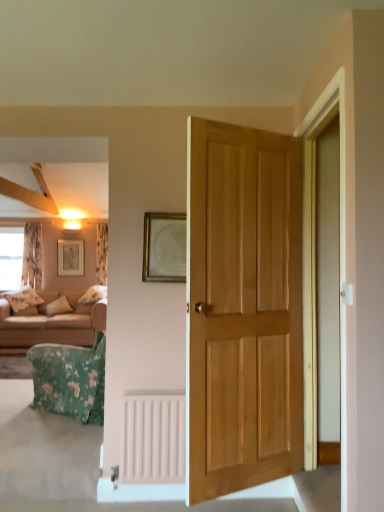
Question: Does beige fabric couch at left have a greater height compared to floral fabric curtain at left, which is the 1th curtain from right to left?

Choices:
 (A) yes
 (B) no

Answer: (B)

Question: Is beige fabric couch at left facing away from floral fabric curtain at left, the second curtain when ordered from left to right?

Choices:
 (A) yes
 (B) no

Answer: (B)

Question: Considering the relative positions of beige fabric couch at left and floral fabric curtain at left, the second curtain when ordered from left to right, in the image provided, is beige fabric couch at left to the right of floral fabric curtain at left, the second curtain when ordered from left to right, from the viewer's perspective?

Choices:
 (A) yes
 (B) no

Answer: (B)

Question: Is beige fabric couch at left positioned in front of floral fabric curtain at left, the second curtain when ordered from left to right?

Choices:
 (A) yes
 (B) no

Answer: (A)

Question: From a real-world perspective, is beige fabric couch at left located beneath floral fabric curtain at left, which is the 1th curtain from right to left?

Choices:
 (A) yes
 (B) no

Answer: (A)

Question: Considering the positions of gold metallic picture frame at center, which is counted as the first picture frame, starting from the front, and light brown wooden door at center in the image, is gold metallic picture frame at center, which is counted as the first picture frame, starting from the front, bigger or smaller than light brown wooden door at center?

Choices:
 (A) big
 (B) small

Answer: (B)

Question: From a real-world perspective, is gold metallic picture frame at center, which ranks as the second picture frame in back-to-front order, above or below light brown wooden door at center?

Choices:
 (A) above
 (B) below

Answer: (A)

Question: Relative to light brown wooden door at center, is gold metallic picture frame at center, which ranks as the second picture frame in back-to-front order, in front or behind?

Choices:
 (A) front
 (B) behind

Answer: (B)

Question: Choose the correct answer: Is gold metallic picture frame at center, which ranks as the second picture frame in back-to-front order, inside light brown wooden door at center or outside it?

Choices:
 (A) inside
 (B) outside

Answer: (B)

Question: Is beige fabric couch at left situated inside floral fabric curtain at left, which is the 1th curtain from right to left, or outside?

Choices:
 (A) outside
 (B) inside

Answer: (A)

Question: Based on their positions, is beige fabric couch at left located to the left or right of floral fabric curtain at left, which is the 1th curtain from right to left?

Choices:
 (A) left
 (B) right

Answer: (A)

Question: Considering the positions of point (8, 343) and point (102, 276), is point (8, 343) closer or farther from the camera than point (102, 276)?

Choices:
 (A) closer
 (B) farther

Answer: (A)

Question: Is beige fabric couch at left taller or shorter than floral fabric curtain at left, which is the 1th curtain from right to left?

Choices:
 (A) tall
 (B) short

Answer: (B)

Question: From a real-world perspective, relative to floral fabric curtain at left, the second curtain when ordered from left to right, is light brown wooden door at center vertically above or below?

Choices:
 (A) below
 (B) above

Answer: (A)

Question: Is light brown wooden door at center bigger or smaller than floral fabric curtain at left, which is the 1th curtain from right to left?

Choices:
 (A) big
 (B) small

Answer: (A)